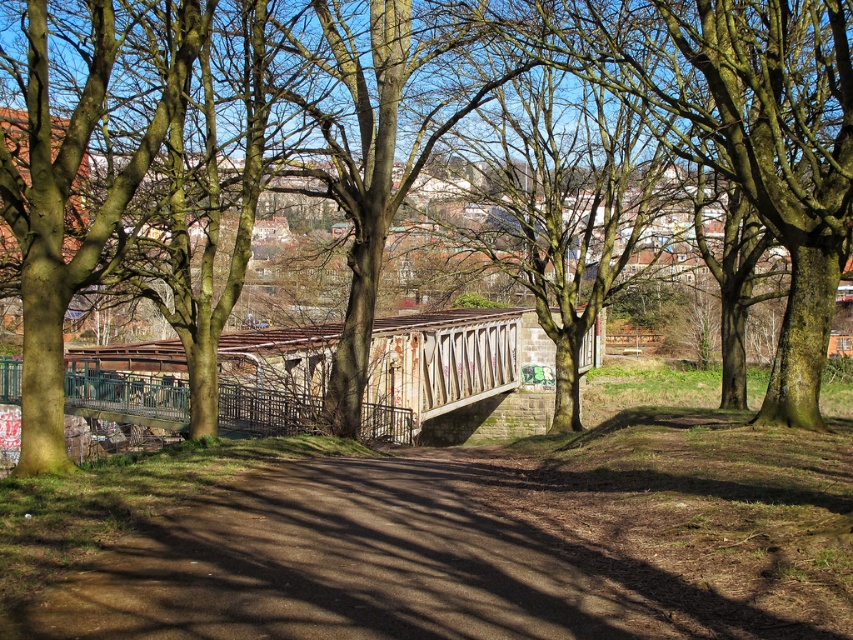
Identify the location of brown dirt path at center. (490, 547).

Where is `brown dirt path at center`? brown dirt path at center is located at coordinates (490, 547).